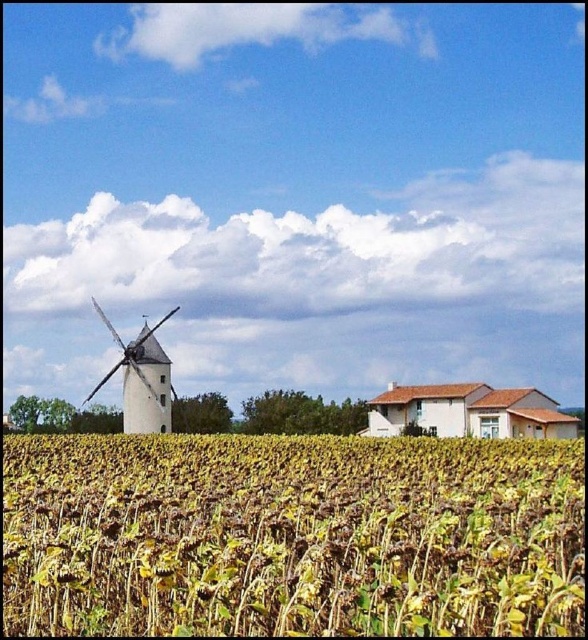
Question: Does yellow-green sunflower field at lower center have a smaller size compared to white matte windmill at left?

Choices:
 (A) no
 (B) yes

Answer: (A)

Question: Among these objects, which one is nearest to the camera?

Choices:
 (A) white matte windmill at left
 (B) yellow-green sunflower field at lower center

Answer: (B)

Question: Is yellow-green sunflower field at lower center wider than white matte windmill at left?

Choices:
 (A) no
 (B) yes

Answer: (B)

Question: Considering the relative positions of yellow-green sunflower field at lower center and white matte windmill at left in the image provided, where is yellow-green sunflower field at lower center located with respect to white matte windmill at left?

Choices:
 (A) right
 (B) left

Answer: (A)